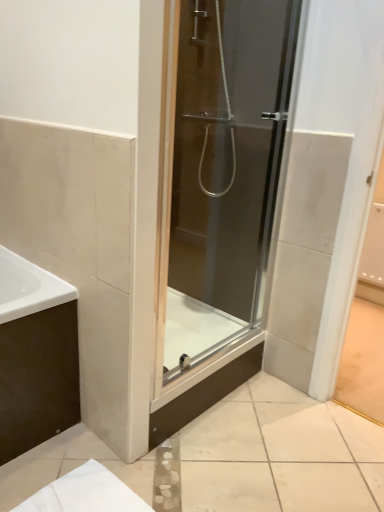
Identify the location of transparent glass shower door at center. (225, 170).

This screenshot has width=384, height=512. Describe the element at coordinates (225, 170) in the screenshot. I see `transparent glass shower door at center` at that location.

Find the location of a particular element. The image size is (384, 512). transparent glass shower door at center is located at coordinates (225, 170).